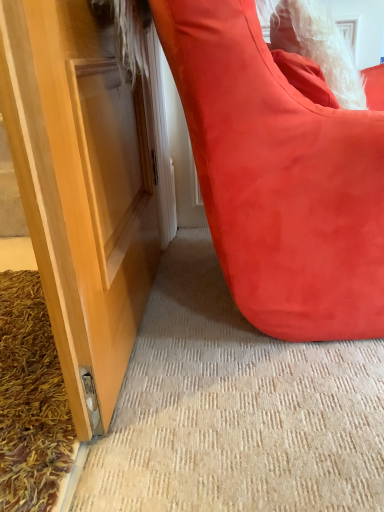
Question: Considering the positions of suede-like red bean bag at lower right and shaggy brown doormat at lower left in the image, is suede-like red bean bag at lower right wider or thinner than shaggy brown doormat at lower left?

Choices:
 (A) thin
 (B) wide

Answer: (A)

Question: From the image's perspective, is suede-like red bean bag at lower right positioned above or below shaggy brown doormat at lower left?

Choices:
 (A) below
 (B) above

Answer: (B)

Question: Considering their positions, is suede-like red bean bag at lower right located in front of or behind shaggy brown doormat at lower left?

Choices:
 (A) front
 (B) behind

Answer: (A)

Question: From the image's perspective, is shaggy brown doormat at lower left located above or below suede-like red bean bag at lower right?

Choices:
 (A) above
 (B) below

Answer: (B)

Question: In terms of size, does shaggy brown doormat at lower left appear bigger or smaller than suede-like red bean bag at lower right?

Choices:
 (A) big
 (B) small

Answer: (B)

Question: Is point (162, 480) closer or farther from the camera than point (216, 67)?

Choices:
 (A) farther
 (B) closer

Answer: (A)

Question: In terms of height, does shaggy brown doormat at lower left look taller or shorter compared to suede-like red bean bag at lower right?

Choices:
 (A) tall
 (B) short

Answer: (B)